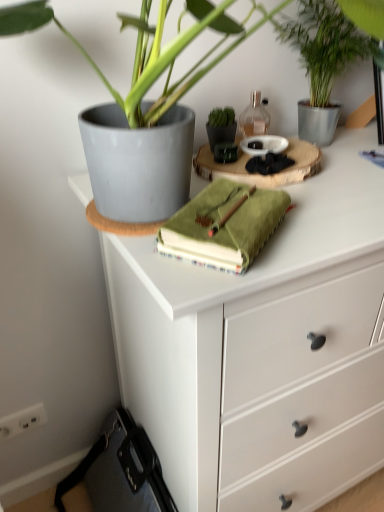
Question: Is translucent glass bottle at upper center positioned in front of white matte chest of drawers at upper center?

Choices:
 (A) no
 (B) yes

Answer: (A)

Question: From a real-world perspective, is translucent glass bottle at upper center below white matte chest of drawers at upper center?

Choices:
 (A) no
 (B) yes

Answer: (A)

Question: Is translucent glass bottle at upper center to the left of white matte chest of drawers at upper center from the viewer's perspective?

Choices:
 (A) yes
 (B) no

Answer: (A)

Question: Is translucent glass bottle at upper center wider than white matte chest of drawers at upper center?

Choices:
 (A) no
 (B) yes

Answer: (A)

Question: From a real-world perspective, is translucent glass bottle at upper center over white matte chest of drawers at upper center?

Choices:
 (A) yes
 (B) no

Answer: (A)

Question: Is translucent glass bottle at upper center positioned behind white matte chest of drawers at upper center?

Choices:
 (A) yes
 (B) no

Answer: (A)

Question: Can translucent glass bottle at upper center be found inside white matte chest of drawers at upper center?

Choices:
 (A) yes
 (B) no

Answer: (B)

Question: Is white matte chest of drawers at upper center beside translucent glass bottle at upper center?

Choices:
 (A) no
 (B) yes

Answer: (A)

Question: Can you confirm if white matte chest of drawers at upper center is smaller than translucent glass bottle at upper center?

Choices:
 (A) yes
 (B) no

Answer: (B)

Question: Is white matte chest of drawers at upper center further to the viewer compared to translucent glass bottle at upper center?

Choices:
 (A) yes
 (B) no

Answer: (B)

Question: Is white matte chest of drawers at upper center not inside translucent glass bottle at upper center?

Choices:
 (A) no
 (B) yes

Answer: (B)

Question: Is white matte chest of drawers at upper center far away from translucent glass bottle at upper center?

Choices:
 (A) no
 (B) yes

Answer: (A)

Question: From the image's perspective, is green matte flowerpot at center on top of green leafy plant at upper right?

Choices:
 (A) no
 (B) yes

Answer: (A)